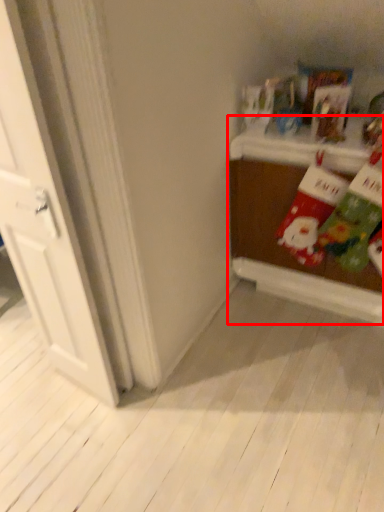
Question: From the image, what is the correct spatial relationship of table (annotated by the red box) in relation to door?

Choices:
 (A) right
 (B) left

Answer: (A)